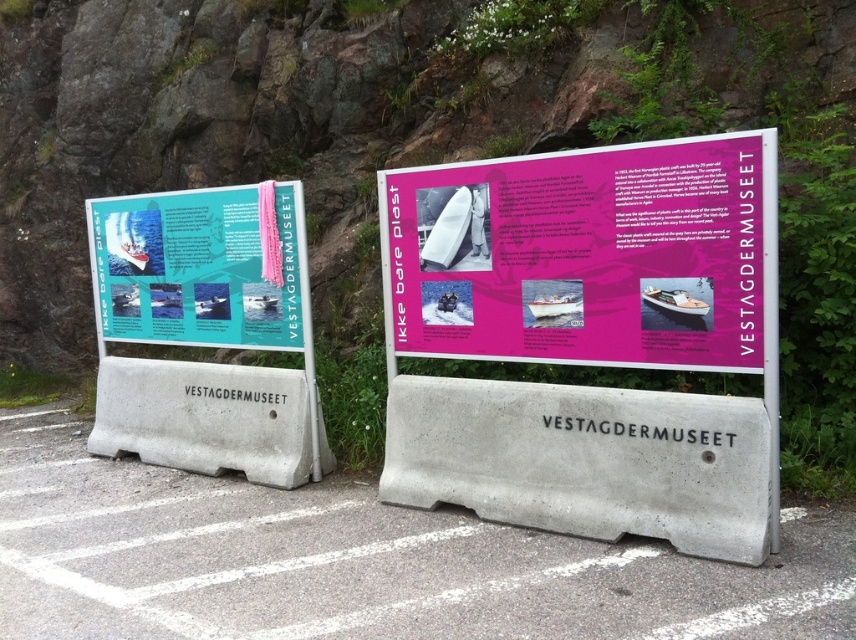
Question: Which object is the closest to the teal paper poster at center left?

Choices:
 (A) pink paperboard poster at center
 (B) concrete at center

Answer: (B)

Question: Is concrete at center to the left of pink paperboard poster at center from the viewer's perspective?

Choices:
 (A) no
 (B) yes

Answer: (B)

Question: Does concrete at center appear on the right side of pink paperboard poster at center?

Choices:
 (A) no
 (B) yes

Answer: (A)

Question: Which object is farther from the camera taking this photo?

Choices:
 (A) teal paper poster at center left
 (B) concrete at center

Answer: (A)

Question: Does pink paperboard poster at center have a greater width compared to teal paper poster at center left?

Choices:
 (A) yes
 (B) no

Answer: (A)

Question: Which point is farther to the camera?

Choices:
 (A) (420, 320)
 (B) (150, 486)
 (C) (205, 193)

Answer: (C)